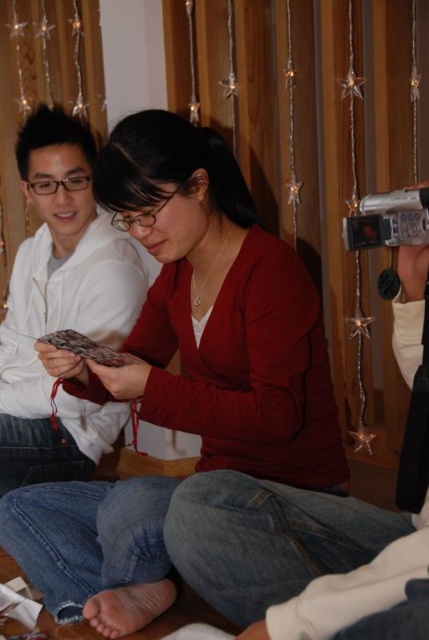
Describe the element at coordinates (60, 305) in the screenshot. The height and width of the screenshot is (640, 429). I see `white matte sweater at left` at that location.

Can you confirm if white matte sweater at left is positioned to the left of silver metallic video camera at upper right?

Yes, white matte sweater at left is to the left of silver metallic video camera at upper right.

This screenshot has height=640, width=429. Identify the location of white matte sweater at left. (60, 305).

Identify the location of white matte sweater at left. This screenshot has height=640, width=429. (60, 305).

Consider the image. Who is more forward, (x=172, y=220) or (x=42, y=385)?

Point (x=172, y=220)

Does matte red sweater at center appear on the left side of white matte sweater at left?

No, matte red sweater at center is not to the left of white matte sweater at left.

Locate an element on the screen. Image resolution: width=429 pixels, height=640 pixels. matte red sweater at center is located at coordinates (214, 312).

Does matte red sweater at center appear over silver metallic video camera at upper right?

No.

Is point (229, 241) closer to camera compared to point (359, 240)?

No, (229, 241) is behind (359, 240).

Image resolution: width=429 pixels, height=640 pixels. What are the coordinates of `matte red sweater at center` in the screenshot? It's located at (214, 312).